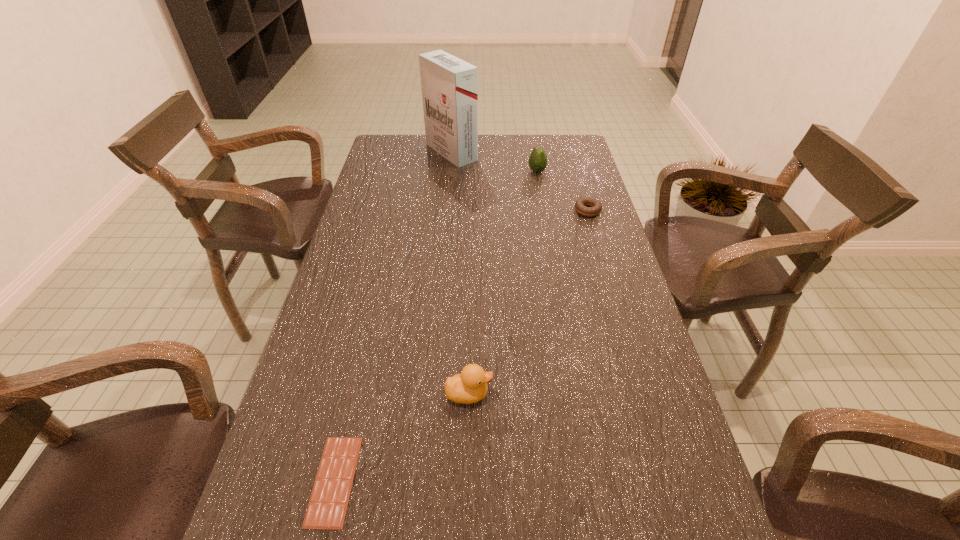
Identify which object is the fourth closest to the avocado. Please provide its 2D coordinates. Your answer should be formatted as a tuple, i.e. [(x, y)], where the tuple contains the x and y coordinates of a point satisfying the conditions above.

[(327, 507)]

Identify the location of free space that satisfies the following two spatial constraints: 1. on the front side of the third nearest object; 2. on the face of the fourth farthest object. (642, 394).